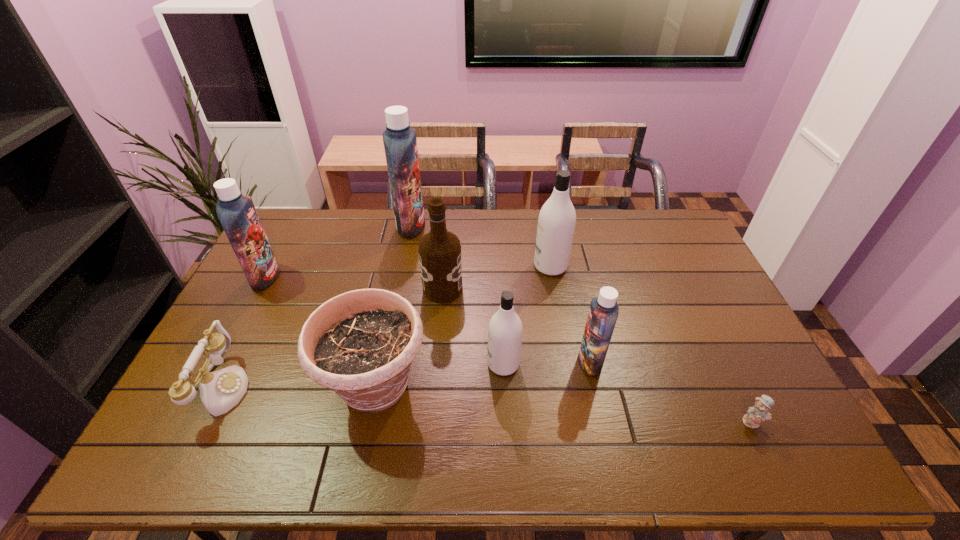
Where is `vacant area situated on the front-facing side of the farther white shampoo`? vacant area situated on the front-facing side of the farther white shampoo is located at coordinates (417, 266).

Where is `vacant space located on the label of the brown alcohol`? The width and height of the screenshot is (960, 540). vacant space located on the label of the brown alcohol is located at coordinates (555, 289).

The width and height of the screenshot is (960, 540). What are the coordinates of `free space located on the front label of the nearest blue shampoo` in the screenshot? It's located at (503, 361).

The width and height of the screenshot is (960, 540). I want to click on vacant space positioned 0.170m on the front label of the nearest blue shampoo, so click(517, 361).

Where is `free space located 0.380m on the front label of the nearest blue shampoo`? The height and width of the screenshot is (540, 960). free space located 0.380m on the front label of the nearest blue shampoo is located at coordinates (x=442, y=361).

Where is `vacant area situated on the front-facing side of the left white shampoo`? The image size is (960, 540). vacant area situated on the front-facing side of the left white shampoo is located at coordinates (375, 364).

Identify the location of free region located on the front-facing side of the left white shampoo. (386, 364).

The height and width of the screenshot is (540, 960). I want to click on blank space located on the front-facing side of the left white shampoo, so click(x=444, y=364).

You are a GUI agent. You are given a task and a screenshot of the screen. Output one action in this format:
    pyautogui.click(x=<x>, y=<y>)
    Task: Click on the free spot located 0.320m on the left of the seventh tallest object
    
    Given the screenshot: What is the action you would take?
    pyautogui.click(x=200, y=387)

Locate an element on the screen. The image size is (960, 540). free spot located on the dial of the white telephone is located at coordinates (400, 387).